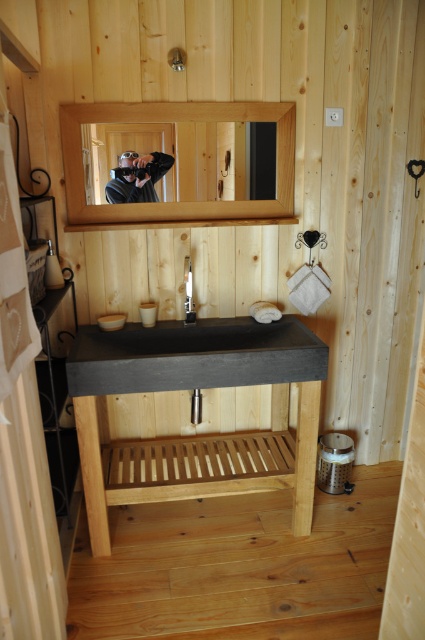
Question: Does black concrete sink at center appear on the left side of dark concrete sink at center?

Choices:
 (A) no
 (B) yes

Answer: (A)

Question: Which point is farther from the camera taking this photo?

Choices:
 (A) click(x=263, y=104)
 (B) click(x=90, y=525)
 (C) click(x=207, y=380)
 (D) click(x=147, y=180)

Answer: (D)

Question: In this image, where is black concrete sink at center located relative to matte black camera at upper center?

Choices:
 (A) below
 (B) above

Answer: (A)

Question: Is the position of clear glass mirror at upper center less distant than that of matte black camera at upper center?

Choices:
 (A) yes
 (B) no

Answer: (A)

Question: Which point is closer to the camera taking this photo?

Choices:
 (A) (155, 468)
 (B) (147, 198)

Answer: (B)

Question: Which point is farther from the camera taking this photo?

Choices:
 (A) (159, 113)
 (B) (115, 170)

Answer: (B)